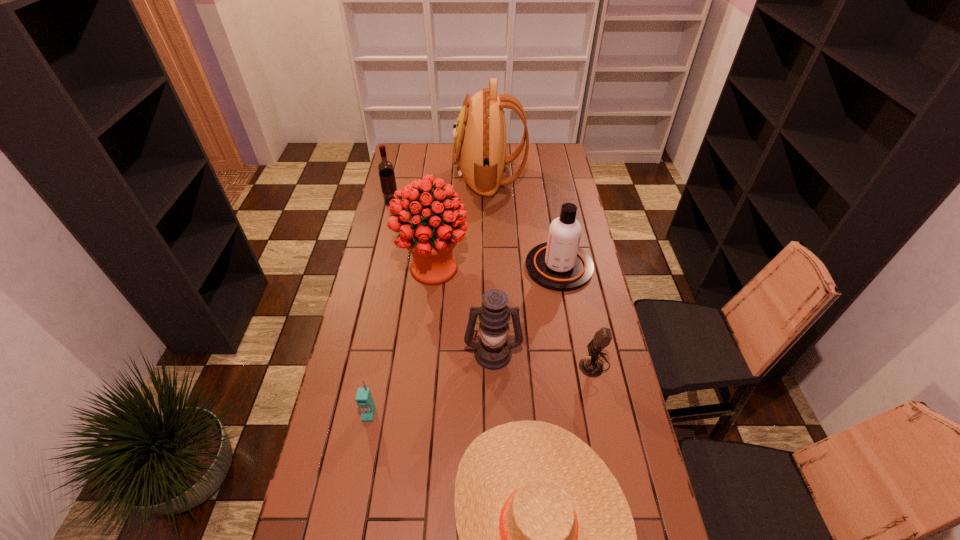
Locate an element on the screen. This screenshot has height=540, width=960. blank space located on the front of the bouquet is located at coordinates (422, 375).

Where is `vacant space located 0.110m on the back of the cleansing agent`? The image size is (960, 540). vacant space located 0.110m on the back of the cleansing agent is located at coordinates (552, 227).

You are a GUI agent. You are given a task and a screenshot of the screen. Output one action in this format:
    pyautogui.click(x=<x>, y=<y>)
    Task: Click on the vacant space situated on the front of the leftmost object
    This screenshot has width=960, height=540.
    Given the screenshot: What is the action you would take?
    pyautogui.click(x=389, y=216)

This screenshot has width=960, height=540. In order to click on free location located 0.370m on the front of the oil lamp in this screenshot , I will do `click(496, 490)`.

Identify the location of vacant space located on the front-facing side of the microphone. This screenshot has width=960, height=540. (542, 364).

I want to click on free space located on the front-facing side of the microphone, so click(x=467, y=364).

Where is `vacant point located on the front-facing side of the microphone`? The width and height of the screenshot is (960, 540). vacant point located on the front-facing side of the microphone is located at coordinates (493, 364).

The image size is (960, 540). What are the coordinates of `vacant space located on the keypad of the seventh farthest object` in the screenshot? It's located at (358, 474).

Identify the location of object at the far edge. (479, 152).

Where is `bouquet situated at the left edge`? The width and height of the screenshot is (960, 540). bouquet situated at the left edge is located at coordinates (431, 238).